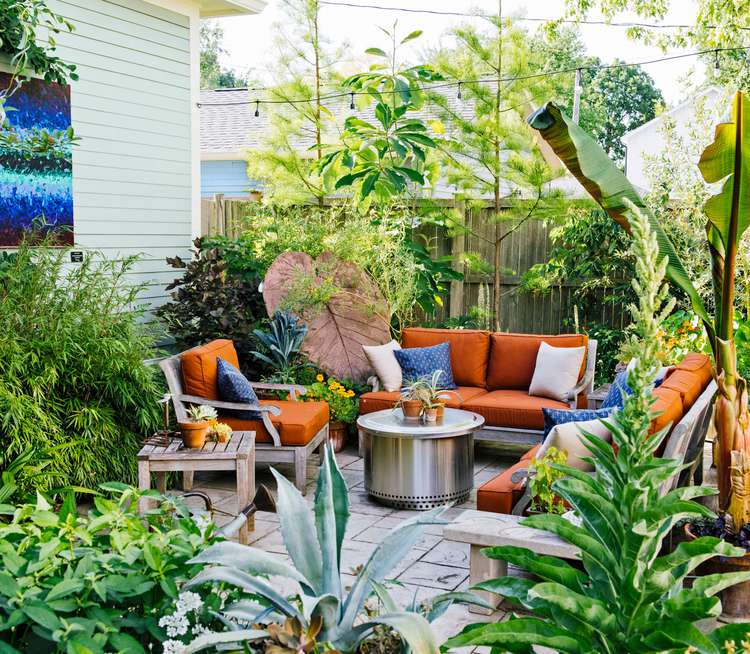
I want to click on orange seats, so click(x=291, y=414).